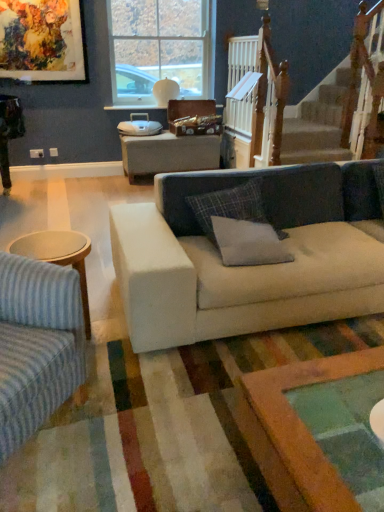
Measure the distance between gray fabric pillow at center, which appears as the first pillow when ordered from the bottom, and camera.

They are 7.03 feet apart.

Find the location of a particular element. This screenshot has height=512, width=384. gray fabric pillow at center, which ranks as the 2th pillow in top-to-bottom order is located at coordinates (248, 243).

Measure the distance between white wooden railing at upper right and camera.

A distance of 4.62 meters exists between white wooden railing at upper right and camera.

The image size is (384, 512). What do you see at coordinates (42, 41) in the screenshot? I see `oil painting at upper left` at bounding box center [42, 41].

In the scene shown: Measure the distance between beige fabric couch at center, which appears as the 1th studio couch when viewed from the right, and camera.

beige fabric couch at center, which appears as the 1th studio couch when viewed from the right, is 1.87 meters from camera.

Measure the distance between point (164, 72) and camera.

Point (164, 72) is 17.99 feet from camera.

Find the location of `gray fabric pillow at center, which appears as the first pillow when ordered from the bottom`. gray fabric pillow at center, which appears as the first pillow when ordered from the bottom is located at coordinates (248, 243).

Who is more distant, gray fabric pillow at center, which ranks as the 2th pillow in top-to-bottom order, or white wooden railing at upper right?

white wooden railing at upper right.

Which is nearer, (x=236, y=265) or (x=282, y=64)?

Point (x=236, y=265).

Based on the photo, considering the relative sizes of gray fabric pillow at center, which appears as the first pillow when ordered from the bottom, and white wooden railing at upper right in the image provided, is gray fabric pillow at center, which appears as the first pillow when ordered from the bottom, thinner than white wooden railing at upper right?

Incorrect, the width of gray fabric pillow at center, which appears as the first pillow when ordered from the bottom, is not less than that of white wooden railing at upper right.

Can you tell me how much gray fabric pillow at center, which appears as the first pillow when ordered from the bottom, and white wooden railing at upper right differ in facing direction?

91.3 degrees separate the facing orientations of gray fabric pillow at center, which appears as the first pillow when ordered from the bottom, and white wooden railing at upper right.

Is clear glass window at upper center next to oil painting at upper left and touching it?

No.

I want to click on window on the right of oil painting at upper left, so point(161,48).

Is clear glass window at upper center in front of or behind oil painting at upper left in the image?

clear glass window at upper center is behind oil painting at upper left.

Is clear glass window at upper center turned away from oil painting at upper left?

No, clear glass window at upper center's orientation is not away from oil painting at upper left.

From a real-world perspective, is clear glass window at upper center beneath beige fabric couch at center, placed as the second studio couch when sorted from left to right?

No.

Considering the relative sizes of clear glass window at upper center and beige fabric couch at center, placed as the second studio couch when sorted from left to right, in the image provided, is clear glass window at upper center bigger than beige fabric couch at center, placed as the second studio couch when sorted from left to right,?

No.

Can you confirm if clear glass window at upper center is thinner than beige fabric couch at center, which appears as the 1th studio couch when viewed from the right?

Yes, clear glass window at upper center is thinner than beige fabric couch at center, which appears as the 1th studio couch when viewed from the right.

Is clear glass window at upper center to the right of beige fabric couch at center, placed as the second studio couch when sorted from left to right, from the viewer's perspective?

No.

Considering the sizes of gray fabric pillow at center, which ranks as the 2th pillow in top-to-bottom order, and beige fabric couch at center, which appears as the 1th studio couch when viewed from the right, in the image, is gray fabric pillow at center, which ranks as the 2th pillow in top-to-bottom order, taller or shorter than beige fabric couch at center, which appears as the 1th studio couch when viewed from the right,?

gray fabric pillow at center, which ranks as the 2th pillow in top-to-bottom order, is shorter than beige fabric couch at center, which appears as the 1th studio couch when viewed from the right.

Could you tell me if gray fabric pillow at center, which ranks as the 2th pillow in top-to-bottom order, is turned towards beige fabric couch at center, which appears as the 1th studio couch when viewed from the right?

Yes, gray fabric pillow at center, which ranks as the 2th pillow in top-to-bottom order, is turned towards beige fabric couch at center, which appears as the 1th studio couch when viewed from the right.

Does gray fabric pillow at center, which appears as the first pillow when ordered from the bottom, have a lesser width compared to beige fabric couch at center, placed as the second studio couch when sorted from left to right?

Yes, gray fabric pillow at center, which appears as the first pillow when ordered from the bottom, is thinner than beige fabric couch at center, placed as the second studio couch when sorted from left to right.

From a real-world perspective, who is located lower, beige fabric couch at center, which appears as the 1th studio couch when viewed from the right, or plaid fabric pillow at center, which is the 1th pillow from top to bottom?

In real-world perspective, beige fabric couch at center, which appears as the 1th studio couch when viewed from the right, is lower.

Could you tell me if beige fabric couch at center, placed as the second studio couch when sorted from left to right, is facing plaid fabric pillow at center, which is the 1th pillow from top to bottom?

No, beige fabric couch at center, placed as the second studio couch when sorted from left to right, does not turn towards plaid fabric pillow at center, which is the 1th pillow from top to bottom.

How different are the orientations of beige fabric couch at center, which appears as the 1th studio couch when viewed from the right, and plaid fabric pillow at center, which is the 1th pillow from top to bottom, in degrees?

The angle between the facing direction of beige fabric couch at center, which appears as the 1th studio couch when viewed from the right, and the facing direction of plaid fabric pillow at center, which is the 1th pillow from top to bottom, is 0.443 degrees.

From the image's perspective, is beige fabric couch at center, placed as the second studio couch when sorted from left to right, positioned above or below plaid fabric pillow at center, which is the 1th pillow from top to bottom?

Based on their image positions, beige fabric couch at center, placed as the second studio couch when sorted from left to right, is located beneath plaid fabric pillow at center, which is the 1th pillow from top to bottom.

From the image's perspective, starting from the light blue fabric couch at left, positioned as the 1th studio couch in left-to-right order, which pillow is the 1st one above? Please provide its 2D coordinates.

[(248, 243)]

From a real-world perspective, is light blue fabric couch at left, placed as the second studio couch when sorted from right to left, below gray fabric pillow at center, which appears as the first pillow when ordered from the bottom?

Correct, in the physical world, light blue fabric couch at left, placed as the second studio couch when sorted from right to left, is lower than gray fabric pillow at center, which appears as the first pillow when ordered from the bottom.

Which object is further away from the camera, light blue fabric couch at left, positioned as the 1th studio couch in left-to-right order, or gray fabric pillow at center, which ranks as the 2th pillow in top-to-bottom order?

gray fabric pillow at center, which ranks as the 2th pillow in top-to-bottom order, is behind.

Considering the relative sizes of light blue fabric couch at left, positioned as the 1th studio couch in left-to-right order, and gray fabric pillow at center, which ranks as the 2th pillow in top-to-bottom order, in the image provided, is light blue fabric couch at left, positioned as the 1th studio couch in left-to-right order, taller than gray fabric pillow at center, which ranks as the 2th pillow in top-to-bottom order,?

Yes.

Can you confirm if beige fabric couch at center, placed as the second studio couch when sorted from left to right, is smaller than gray fabric pillow at center, which ranks as the 2th pillow in top-to-bottom order?

No, beige fabric couch at center, placed as the second studio couch when sorted from left to right, is not smaller than gray fabric pillow at center, which ranks as the 2th pillow in top-to-bottom order.

Is beige fabric couch at center, placed as the second studio couch when sorted from left to right, aimed at gray fabric pillow at center, which ranks as the 2th pillow in top-to-bottom order?

No, beige fabric couch at center, placed as the second studio couch when sorted from left to right, is not turned towards gray fabric pillow at center, which ranks as the 2th pillow in top-to-bottom order.

Which pillow is the 1st one when counting from the back of the beige fabric couch at center, placed as the second studio couch when sorted from left to right? Please provide its 2D coordinates.

[(248, 243)]

Where is `rail located above the gray fabric pillow at center, which ranks as the 2th pillow in top-to-bottom order (from the image's perspective)`? The width and height of the screenshot is (384, 512). rail located above the gray fabric pillow at center, which ranks as the 2th pillow in top-to-bottom order (from the image's perspective) is located at coordinates (255, 99).

Find the location of a particular element. This screenshot has width=384, height=512. picture frame on the left side of clear glass window at upper center is located at coordinates tap(42, 41).

When comparing their distances from gray fabric pillow at center, which appears as the first pillow when ordered from the bottom, does light blue fabric couch at left, placed as the second studio couch when sorted from right to left, or oil painting at upper left seem closer?

The object closer to gray fabric pillow at center, which appears as the first pillow when ordered from the bottom, is light blue fabric couch at left, placed as the second studio couch when sorted from right to left.

Which object lies further to the anchor point gray fabric pillow at center, which ranks as the 2th pillow in top-to-bottom order, light blue fabric couch at left, placed as the second studio couch when sorted from right to left, or clear glass window at upper center?

Among the two, clear glass window at upper center is located further to gray fabric pillow at center, which ranks as the 2th pillow in top-to-bottom order.

Based on their spatial positions, is beige fabric couch at center, placed as the second studio couch when sorted from left to right, or plaid fabric pillow at center, which is the 1th pillow from top to bottom, closer to clear glass window at upper center?

plaid fabric pillow at center, which is the 1th pillow from top to bottom.

From the image, which object appears to be nearer to gray fabric pillow at center, which appears as the first pillow when ordered from the bottom, light blue fabric couch at left, positioned as the 1th studio couch in left-to-right order, or beige fabric couch at center, which appears as the 1th studio couch when viewed from the right?

beige fabric couch at center, which appears as the 1th studio couch when viewed from the right, is positioned closer to the anchor gray fabric pillow at center, which appears as the first pillow when ordered from the bottom.

From the image, which object appears to be farther from plaid fabric pillow at center, which is counted as the 2th pillow, starting from the bottom, oil painting at upper left or white wooden railing at upper right?

oil painting at upper left is positioned further to the anchor plaid fabric pillow at center, which is counted as the 2th pillow, starting from the bottom.

Estimate the real-world distances between objects in this image. Which object is closer to plaid fabric pillow at center, which is the 1th pillow from top to bottom, gray fabric pillow at center, which ranks as the 2th pillow in top-to-bottom order, or white wooden railing at upper right?

gray fabric pillow at center, which ranks as the 2th pillow in top-to-bottom order.

Estimate the real-world distances between objects in this image. Which object is closer to clear glass window at upper center, plaid fabric pillow at center, which is the 1th pillow from top to bottom, or oil painting at upper left?

The object closer to clear glass window at upper center is oil painting at upper left.

From the image, which object appears to be nearer to plaid fabric pillow at center, which is the 1th pillow from top to bottom, oil painting at upper left or clear glass window at upper center?

The object closer to plaid fabric pillow at center, which is the 1th pillow from top to bottom, is clear glass window at upper center.

In order to click on pillow located between gray fabric pillow at center, which appears as the first pillow when ordered from the bottom, and white wooden railing at upper right in the depth direction in this screenshot , I will do `click(229, 206)`.

Locate an element on the screen. rail between gray fabric pillow at center, which ranks as the 2th pillow in top-to-bottom order, and clear glass window at upper center in the front-back direction is located at coordinates (255, 99).

You are a GUI agent. You are given a task and a screenshot of the screen. Output one action in this format:
    pyautogui.click(x=<x>, y=<y>)
    Task: Click on the rail between light blue fabric couch at left, positioned as the 1th studio couch in left-to-right order, and oil painting at upper left, along the z-axis
    
    Given the screenshot: What is the action you would take?
    pyautogui.click(x=255, y=99)

I want to click on picture frame between beige fabric couch at center, placed as the second studio couch when sorted from left to right, and clear glass window at upper center in the front-back direction, so click(42, 41).